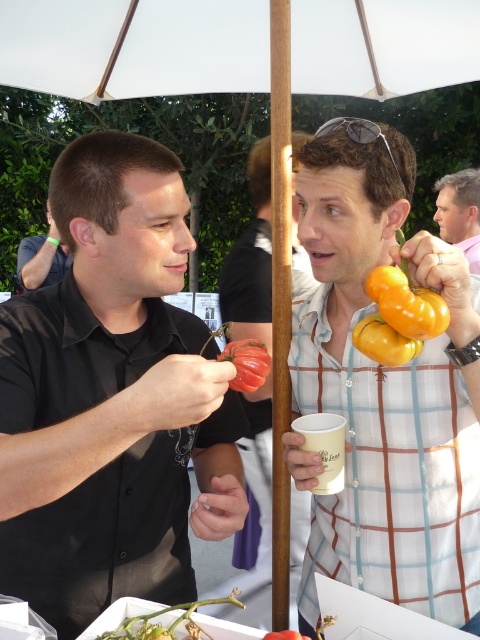
Question: Does matte white shirt at upper right appear over green matte vegetable at lower left?

Choices:
 (A) no
 (B) yes

Answer: (B)

Question: Is matte orange squash at center to the left of green matte vegetable at lower left from the viewer's perspective?

Choices:
 (A) yes
 (B) no

Answer: (B)

Question: Which object is closer to the camera taking this photo?

Choices:
 (A) matte black shirt at left
 (B) green matte vegetable at lower left

Answer: (B)

Question: Which object appears closest to the camera in this image?

Choices:
 (A) black shirt at left
 (B) metallic reflective sunglasses at upper center
 (C) matte yellow squash at right
 (D) yellow matte bell pepper at upper right

Answer: (C)

Question: Based on their relative distances, which object is nearer to the green matte vegetable at lower left?

Choices:
 (A) black shirt at left
 (B) matte black shirt at left
 (C) matte orange pepper at center

Answer: (B)

Question: Can you confirm if matte orange squash at center is smaller than metallic reflective sunglasses at upper center?

Choices:
 (A) yes
 (B) no

Answer: (B)